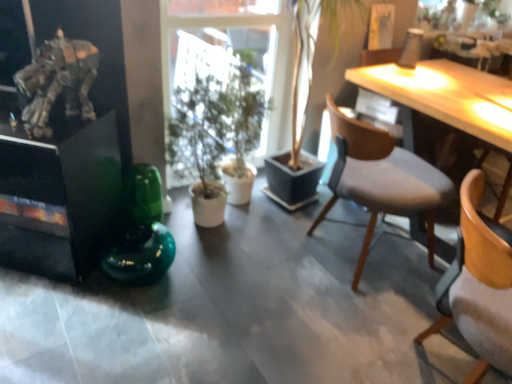
Question: Can you confirm if metallic silver robot at upper left is wider than wooden chair with grey cushion at right, positioned as the first chair in back-to-front order?

Choices:
 (A) no
 (B) yes

Answer: (A)

Question: Is metallic silver robot at upper left to the right of wooden chair with grey cushion at right, positioned as the first chair in back-to-front order, from the viewer's perspective?

Choices:
 (A) yes
 (B) no

Answer: (B)

Question: Would you say metallic silver robot at upper left contains wooden chair with grey cushion at right, which ranks as the 2th chair in front-to-back order?

Choices:
 (A) yes
 (B) no

Answer: (B)

Question: From a real-world perspective, is metallic silver robot at upper left beneath wooden chair with grey cushion at right, which ranks as the 2th chair in front-to-back order?

Choices:
 (A) yes
 (B) no

Answer: (B)

Question: From a real-world perspective, is metallic silver robot at upper left positioned over wooden chair with grey cushion at right, which ranks as the 2th chair in front-to-back order, based on gravity?

Choices:
 (A) no
 (B) yes

Answer: (B)

Question: Is wooden chair at right, positioned as the second chair in back-to-front order, taller or shorter than green glass vase at center?

Choices:
 (A) short
 (B) tall

Answer: (B)

Question: Is point (468, 223) positioned closer to the camera than point (138, 208)?

Choices:
 (A) farther
 (B) closer

Answer: (B)

Question: From the image's perspective, is wooden chair at right, which appears as the first chair when viewed from the front, located above or below green glass vase at center?

Choices:
 (A) below
 (B) above

Answer: (A)

Question: Is wooden chair at right, positioned as the second chair in back-to-front order, in front of or behind green glass vase at center in the image?

Choices:
 (A) behind
 (B) front

Answer: (B)

Question: Relative to wooden chair with grey cushion at right, which ranks as the 2th chair in front-to-back order, is green matte plant at center in front or behind?

Choices:
 (A) front
 (B) behind

Answer: (B)

Question: Considering the relative positions of green matte plant at center and wooden chair with grey cushion at right, positioned as the first chair in back-to-front order, in the image provided, is green matte plant at center to the left or to the right of wooden chair with grey cushion at right, positioned as the first chair in back-to-front order,?

Choices:
 (A) left
 (B) right

Answer: (A)

Question: Considering the positions of green matte plant at center and wooden chair with grey cushion at right, positioned as the first chair in back-to-front order, in the image, is green matte plant at center wider or thinner than wooden chair with grey cushion at right, positioned as the first chair in back-to-front order,?

Choices:
 (A) wide
 (B) thin

Answer: (B)

Question: From the image's perspective, is green matte plant at center positioned above or below wooden chair with grey cushion at right, which ranks as the 2th chair in front-to-back order?

Choices:
 (A) above
 (B) below

Answer: (A)

Question: Is light wood desk at upper right in front of or behind green matte plant at center in the image?

Choices:
 (A) behind
 (B) front

Answer: (A)

Question: In terms of width, does light wood desk at upper right look wider or thinner when compared to green matte plant at center?

Choices:
 (A) wide
 (B) thin

Answer: (A)